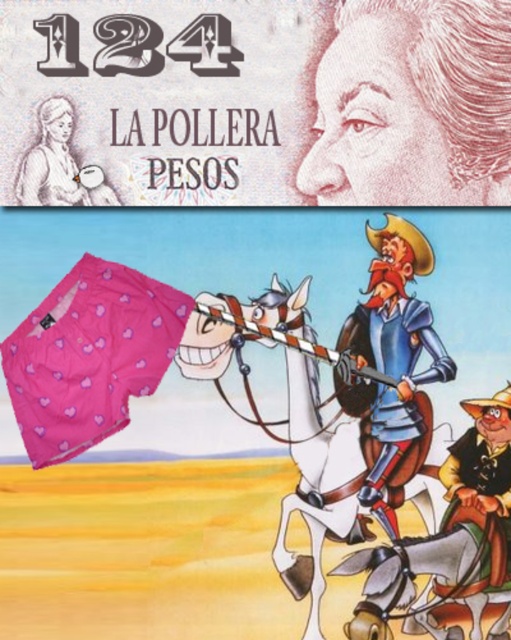
Question: Where is pink paper money at upper center located in relation to smooth blue armor at center in the image?

Choices:
 (A) above
 (B) below

Answer: (A)

Question: Estimate the real-world distances between objects in this image. Which object is farther from the smooth blue armor at center?

Choices:
 (A) brown leather hat at lower right
 (B) pink fabric horse at center
 (C) pink fabric skirt at upper left

Answer: (C)

Question: Which of the following is the closest to the observer?

Choices:
 (A) pink paper money at upper center
 (B) brown leather hat at lower right

Answer: (A)

Question: Does pink paper money at upper center have a larger size compared to pink fabric skirt at upper left?

Choices:
 (A) no
 (B) yes

Answer: (B)

Question: Can you confirm if pink fabric horse at center is smaller than brown leather hat at lower right?

Choices:
 (A) yes
 (B) no

Answer: (B)

Question: Among these objects, which one is nearest to the camera?

Choices:
 (A) pink fabric skirt at upper left
 (B) smooth blue armor at center

Answer: (A)